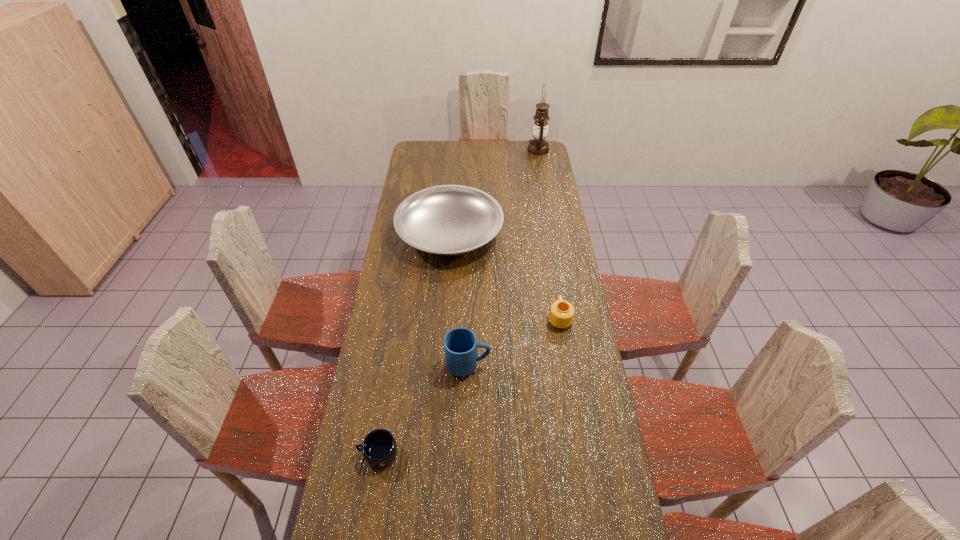
This screenshot has width=960, height=540. Find the location of `vacant space located 0.350m on the side of the second nearest mug with the handle`. vacant space located 0.350m on the side of the second nearest mug with the handle is located at coordinates [590, 366].

Locate an element on the screen. The width and height of the screenshot is (960, 540). free space located 0.210m on the back of the bedpan is located at coordinates (454, 178).

The height and width of the screenshot is (540, 960). I want to click on free region located on the handle side of the rightmost mug, so click(x=547, y=239).

Identify the location of vacant area situated 0.060m on the handle side of the rightmost mug. Image resolution: width=960 pixels, height=540 pixels. (556, 295).

At what (x,y) coordinates should I click in order to perform the action: click on free region located 0.250m on the handle side of the rightmost mug. Please return your answer as a coordinate pair (x, y). Looking at the image, I should click on (551, 262).

Identify the location of object that is at the far edge. (538, 146).

The image size is (960, 540). What are the coordinates of `bedpan that is at the left edge` in the screenshot? It's located at (446, 220).

You are a GUI agent. You are given a task and a screenshot of the screen. Output one action in this format:
    pyautogui.click(x=<x>, y=<y>)
    Task: Click on the mug located in the left edge section of the desktop
    This screenshot has width=960, height=540.
    Given the screenshot: What is the action you would take?
    pyautogui.click(x=379, y=448)

This screenshot has width=960, height=540. I want to click on oil lamp that is at the right edge, so click(538, 146).

The height and width of the screenshot is (540, 960). I want to click on mug that is at the right edge, so click(561, 315).